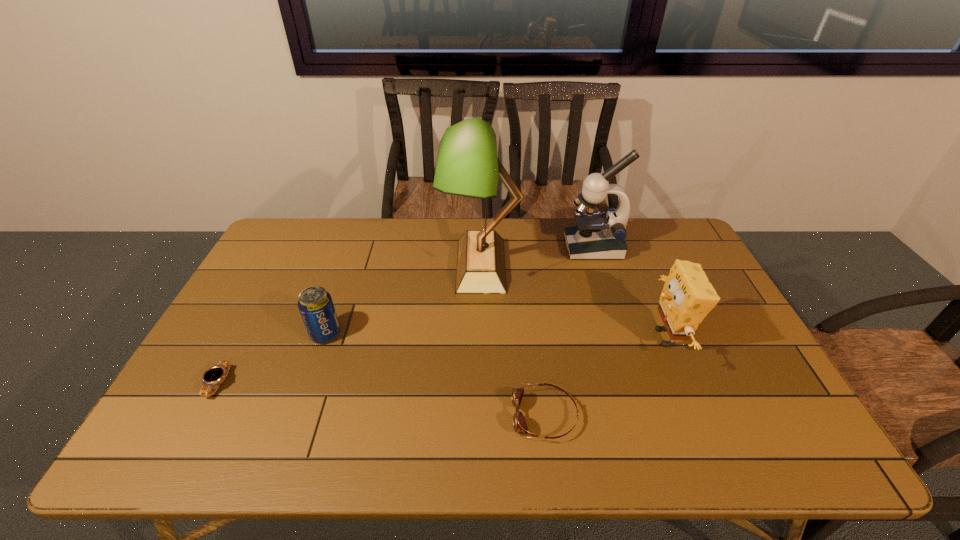
Choose which object is the third nearest neighbor to the watch. Please provide its 2D coordinates. Your answer should be formatted as a tuple, i.e. [(x, y)], where the tuple contains the x and y coordinates of a point satisfying the conditions above.

[(519, 422)]